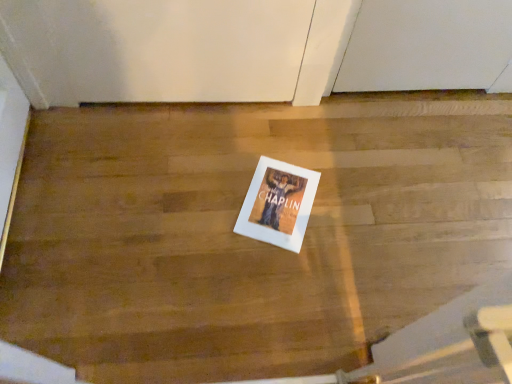
I want to click on free spot above white paper at center (from a real-world perspective), so click(x=276, y=196).